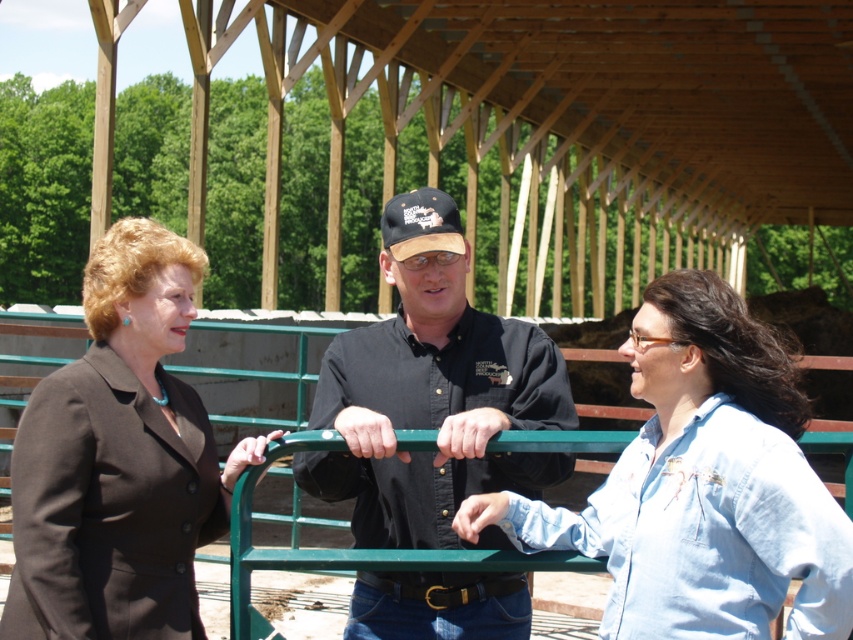
You are a photographer trying to capture a group photo of the matte black suit at left and the black cotton shirt at center. Since you want them to face each other, which one should stand to your left to frame them properly?

The matte black suit at left should stand to your left because it is already positioned on the left side of the black cotton shirt at center, so placing them this way maintains their original spatial relationship for proper framing.

You are standing in the scene and want to greet both the blue denim shirt at center and the matte black suit at left. Which person should you approach first if you want to start with the one closer to you?

The blue denim shirt at center is above the matte black suit at left, so the blue denim shirt at center is closer to you. You should approach the blue denim shirt at center first.

You are standing in the scene and need to locate the blue denim shirt at center and the matte black suit at left. Which one is positioned to the right of the other?

The blue denim shirt at center is to the right of the matte black suit at left.